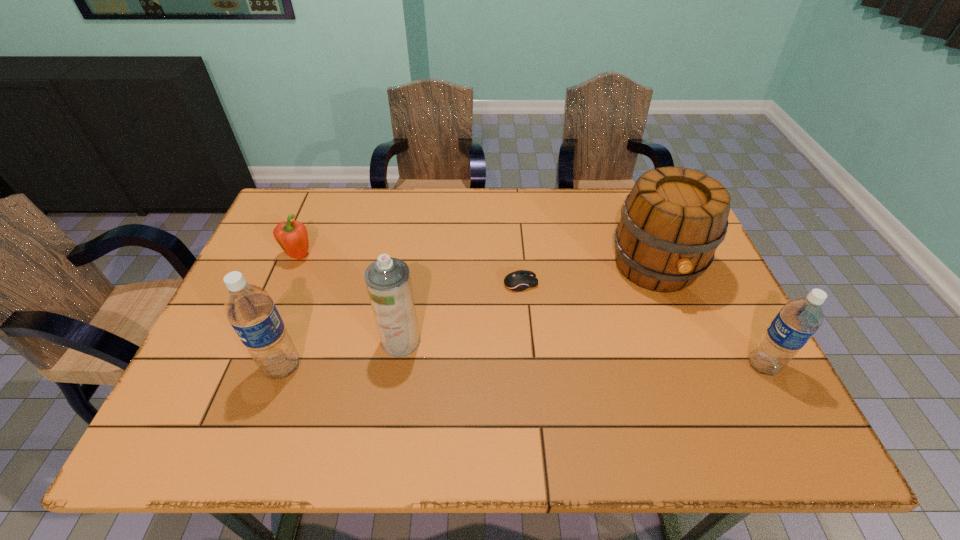
Where is `free space that satisfies the following two spatial constraints: 1. on the front side of the fourth object from left to right; 2. on the right side of the shorter water bottle`? Image resolution: width=960 pixels, height=540 pixels. free space that satisfies the following two spatial constraints: 1. on the front side of the fourth object from left to right; 2. on the right side of the shorter water bottle is located at coordinates (528, 365).

You are a GUI agent. You are given a task and a screenshot of the screen. Output one action in this format:
    pyautogui.click(x=<x>, y=<y>)
    Task: Click on the free region that satisfies the following two spatial constraints: 1. on the side of the cider where the spigot is located; 2. on the right side of the shorter water bottle
    This screenshot has width=960, height=540.
    Given the screenshot: What is the action you would take?
    695,365